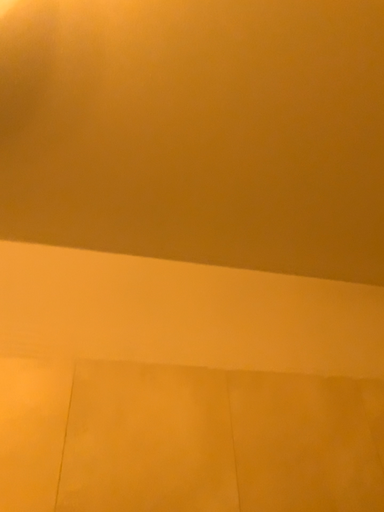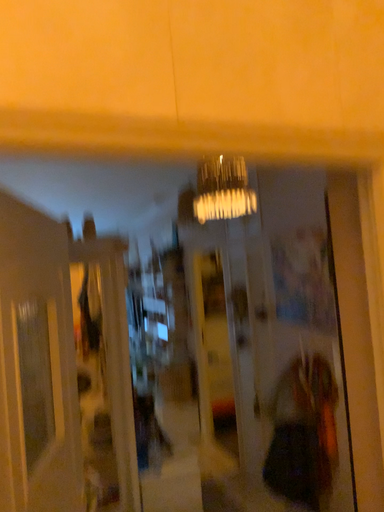
Question: Which way did the camera rotate in the video?

Choices:
 (A) rotated left
 (B) rotated right

Answer: (B)